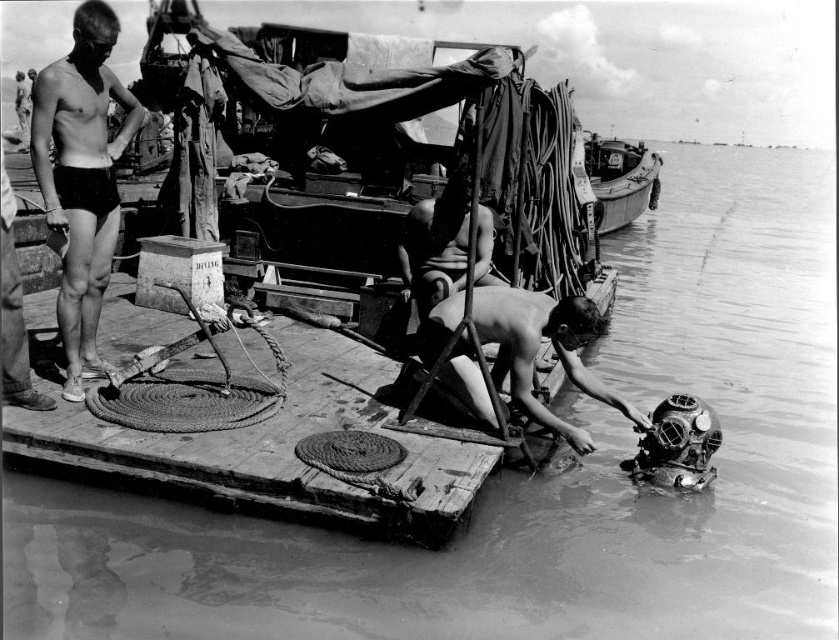
You are standing at the camera position and want to reach the point at coordinates point [300,502]. Can you estimate how far you need to walk to get there?

The distance of point [300,502] from the camera is 42.60 feet, so you need to walk approximately 42.60 feet to reach it.